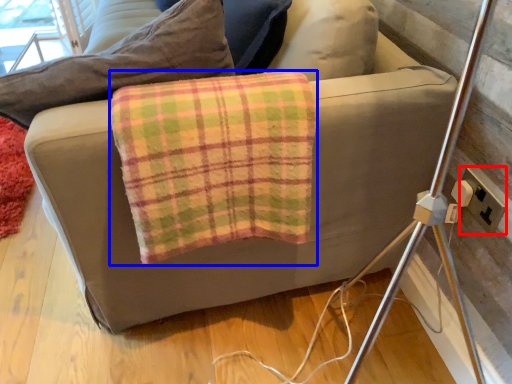
Question: Which of the following is the farthest to the observer, electric outlet (highlighted by a red box) or material (highlighted by a blue box)?

Choices:
 (A) electric outlet
 (B) material

Answer: (A)